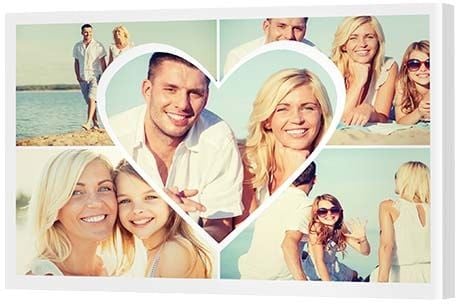
Where is `pictures on the outer edges`? This screenshot has height=304, width=460. pictures on the outer edges is located at coordinates (368, 235), (355, 52), (56, 52), (82, 228).